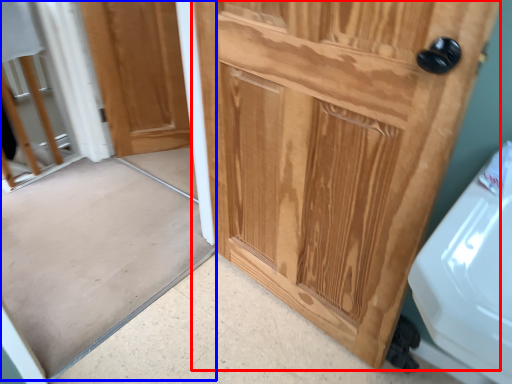
Question: Which object appears farthest to the camera in this image, door (highlighted by a red box) or screen door (highlighted by a blue box)?

Choices:
 (A) door
 (B) screen door

Answer: (B)